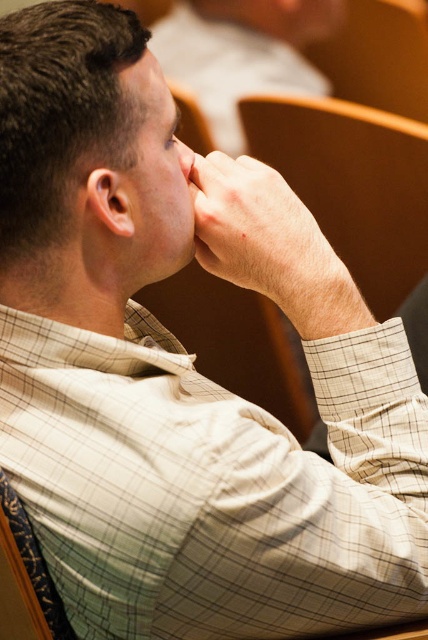
Consider the image. Who is positioned more to the right, brown wood chair at center or smooth skin hand at center?

brown wood chair at center

Who is lower down, brown wood chair at center or smooth skin hand at center?

Positioned lower is smooth skin hand at center.

Does point (379, 272) lie behind point (321, 257)?

Yes.

Where is `brown wood chair at center`? brown wood chair at center is located at coordinates [353, 184].

Who is taller, brown wood chair at center or smooth skin nose at center?

brown wood chair at center is taller.

What do you see at coordinates (353, 184) in the screenshot? I see `brown wood chair at center` at bounding box center [353, 184].

Does point (255, 104) come farther from viewer compared to point (184, 176)?

Yes, it is.

This screenshot has height=640, width=428. I want to click on brown wood chair at center, so click(353, 184).

Is smooth skin hand at center below smooth skin nose at center?

Yes.

Between point (207, 192) and point (181, 168), which one is positioned behind?

The point (207, 192) is more distant.

Locate an element on the screen. The width and height of the screenshot is (428, 640). smooth skin hand at center is located at coordinates (267, 241).